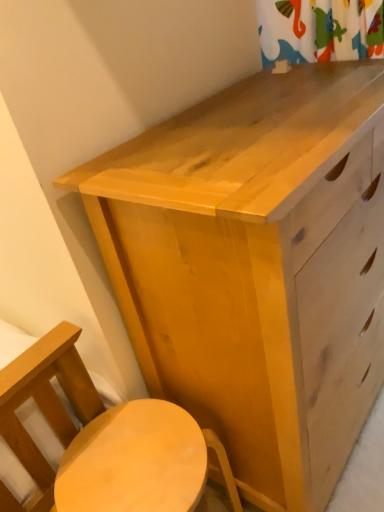
Locate an element on the screen. The width and height of the screenshot is (384, 512). blank space situated above light brown wooden table at lower left (from a real-world perspective) is located at coordinates (131, 463).